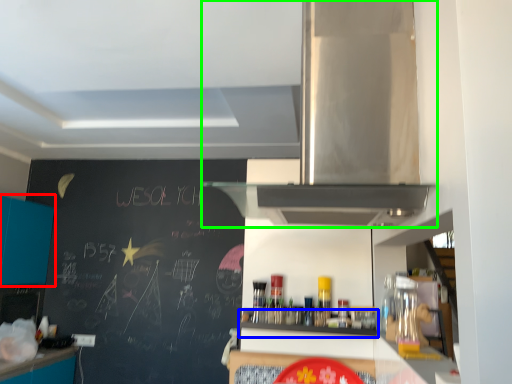
Question: Which is farther away from cabinetry (highlighted by a red box)? shelf (highlighted by a blue box) or home appliance (highlighted by a green box)?

Choices:
 (A) shelf
 (B) home appliance

Answer: (B)